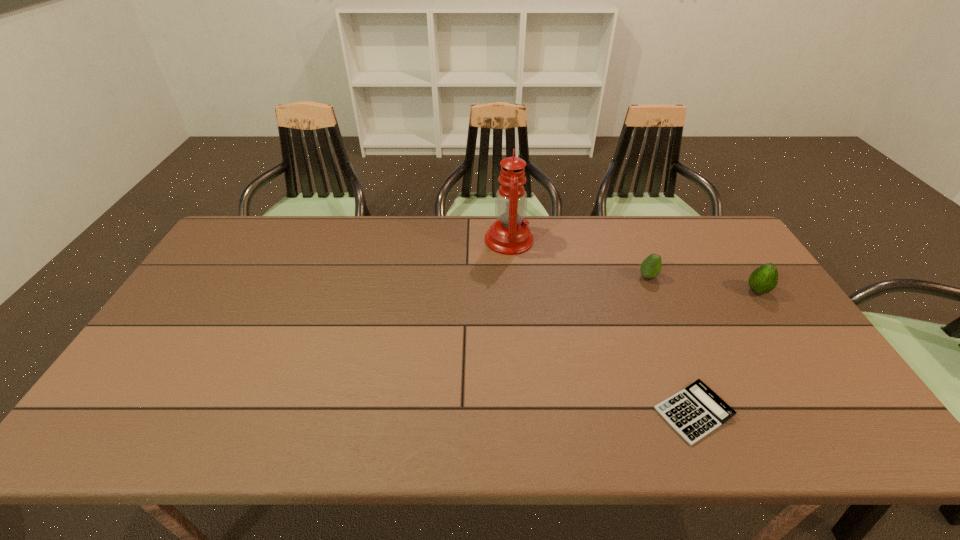
Find the location of a particular element. This screenshot has width=960, height=540. the tallest object is located at coordinates (509, 235).

Find the location of a particular element. The image size is (960, 540). the leftmost object is located at coordinates (509, 235).

This screenshot has width=960, height=540. Identify the location of the rightmost object. tap(764, 279).

Where is `the third tallest object`? This screenshot has width=960, height=540. the third tallest object is located at coordinates (650, 268).

Where is `the left avocado`? the left avocado is located at coordinates (650, 268).

You are a GUI agent. You are given a task and a screenshot of the screen. Output one action in this format:
    pyautogui.click(x=<x>, y=<y>)
    Task: Click on the shortest object
    
    Given the screenshot: What is the action you would take?
    pyautogui.click(x=694, y=412)

You are a GUI agent. You are given a task and a screenshot of the screen. Output one action in this format:
    pyautogui.click(x=<x>, y=<y>)
    Task: Click on the calculator
    Image resolution: width=960 pixels, height=540 pixels.
    Given the screenshot: What is the action you would take?
    pyautogui.click(x=694, y=412)

Locate an element on the screen. vacant space located on the front of the tallest object is located at coordinates (514, 291).

You are a GUI agent. You are given a task and a screenshot of the screen. Output one action in this format:
    pyautogui.click(x=<x>, y=<y>)
    Task: Click on the vacant space located 0.250m on the left of the right avocado
    Image resolution: width=960 pixels, height=540 pixels.
    Given the screenshot: What is the action you would take?
    pyautogui.click(x=662, y=291)

What are the coordinates of `vacant space located 0.080m on the back of the left avocado` in the screenshot? It's located at (638, 255).